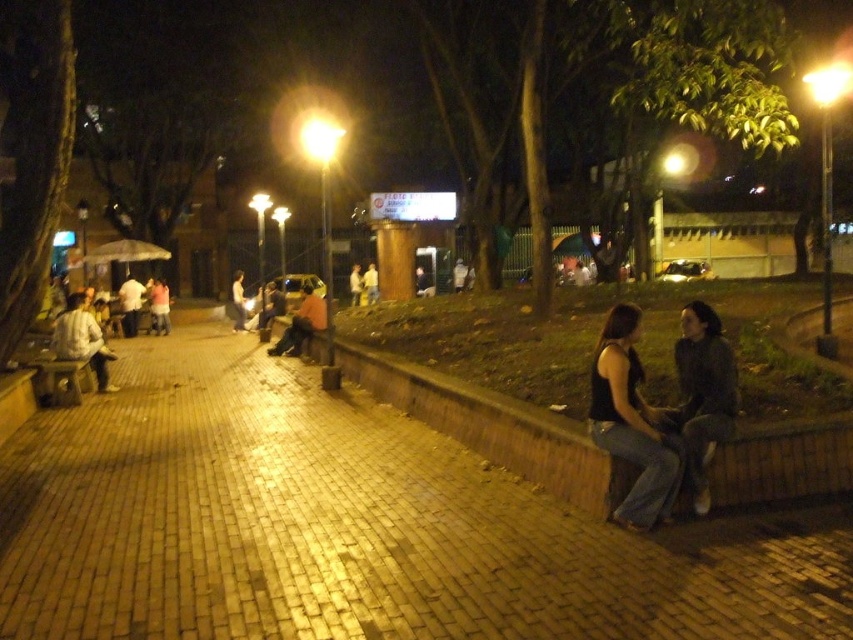
You are standing at the center of the plaza and want to find the white shirt at left. Which direction should you look to locate it?

You should look to the left side since the white shirt at left is located at point (82, 339), which is to the left of the center.

You are a photographer trying to capture both the white shirt at left and the light pink fabric shirt at center in a single frame. Which shirt should you focus on first to ensure both are in focus?

The white shirt at left is smaller than the light pink fabric shirt at center, so you should focus on the light pink fabric shirt at center first because larger subjects often require more precise focus to ensure clarity in the entire frame.

You are standing at the entrance of the park and see two people sitting on a brick wall. One is wearing a dark gray sweater at right and the other has a light pink fabric shirt at center. Which person is positioned more to the right side of the wall?

The dark gray sweater at right is positioned more to the right side of the wall compared to the light pink fabric shirt at center.